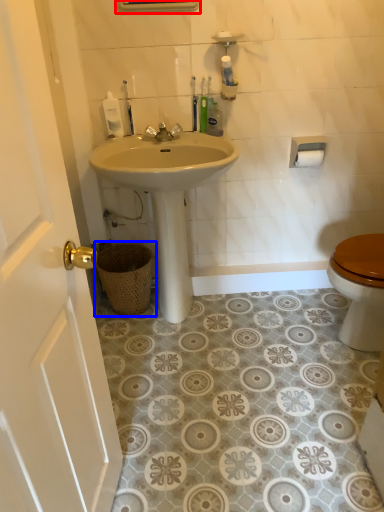
Question: Which of the following is the closest to the observer, medicine cabinet (highlighted by a red box) or basket (highlighted by a blue box)?

Choices:
 (A) medicine cabinet
 (B) basket

Answer: (A)